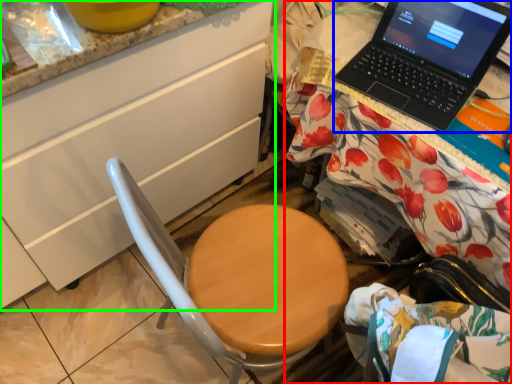
Question: Which object is positioned closest to desk (highlighted by a red box)? Select from laptop (highlighted by a blue box) and cabinetry (highlighted by a green box).

Choices:
 (A) laptop
 (B) cabinetry

Answer: (A)